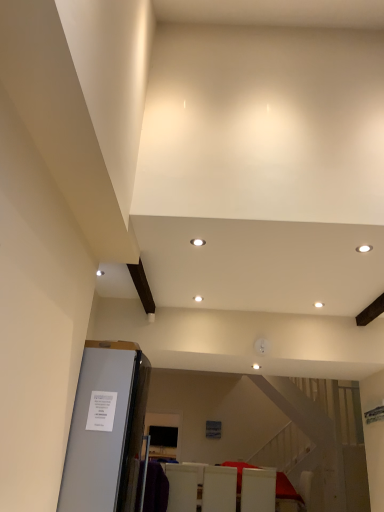
Question: Is white glossy chair at lower center, the first furniture positioned from the right, wider or thinner than satin silver refrigerator at lower left?

Choices:
 (A) thin
 (B) wide

Answer: (A)

Question: From a real-world perspective, is white glossy chair at lower center, the first furniture positioned from the right, above or below satin silver refrigerator at lower left?

Choices:
 (A) above
 (B) below

Answer: (B)

Question: Considering the real-world distances, which object is closest to the white glossy chair at lower center, acting as the third furniture starting from the left?

Choices:
 (A) white matte chair at lower center, the 3th furniture in the right-to-left sequence
 (B) white glossy chairs at lower center, the second furniture when ordered from right to left
 (C) satin silver refrigerator at lower left

Answer: (B)

Question: Which object is positioned closest to the white glossy chair at lower center, the first furniture positioned from the right?

Choices:
 (A) white matte chair at lower center, which appears as the first furniture when viewed from the left
 (B) satin silver refrigerator at lower left
 (C) white glossy chairs at lower center, the 2th furniture when ordered from left to right

Answer: (C)